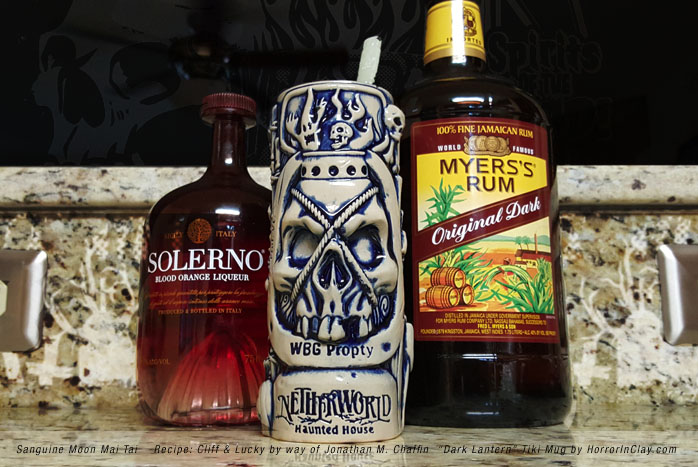
In order to click on bottled of liquer in this screenshot , I will do `click(223, 247)`, `click(493, 189)`.